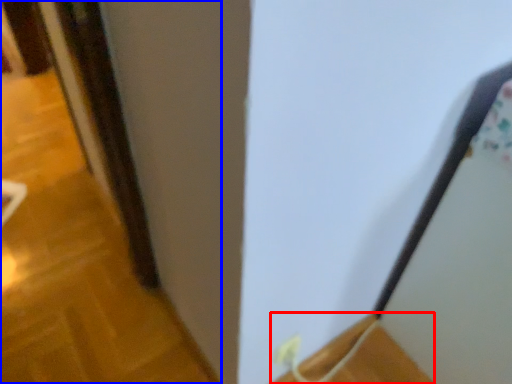
Question: Which point is closer to the camera, wood (highlighted by a red box) or door (highlighted by a blue box)?

Choices:
 (A) wood
 (B) door

Answer: (A)